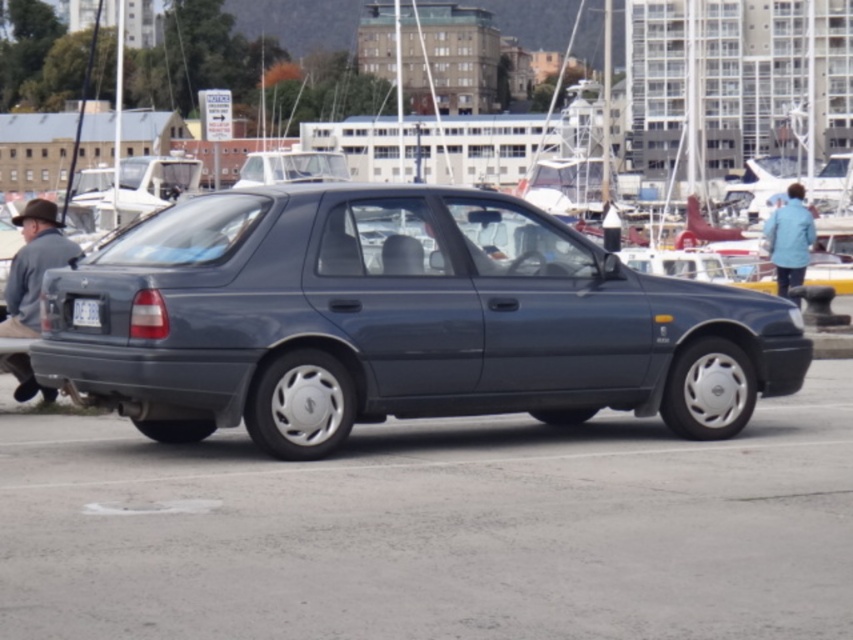
Does point (788, 228) lie in front of point (82, 321)?

No, (788, 228) is behind (82, 321).

Is point (788, 275) positioned in front of point (79, 316)?

No, (788, 275) is behind (79, 316).

You are a GUI agent. You are given a task and a screenshot of the screen. Output one action in this format:
    pyautogui.click(x=<x>, y=<y>)
    Task: Click on the light blue fabric jacket at upper right
    The height and width of the screenshot is (640, 853).
    Given the screenshot: What is the action you would take?
    pyautogui.click(x=788, y=240)

In order to click on brown fabric hat at left in this screenshot , I will do `click(33, 266)`.

Does brown fabric hat at left appear over white plastic license plate at center?

Indeed, brown fabric hat at left is positioned over white plastic license plate at center.

The image size is (853, 640). Identify the location of brown fabric hat at left. (33, 266).

Which is in front, point (33, 232) or point (808, 259)?

Point (33, 232) is more forward.

Describe the element at coordinates (33, 266) in the screenshot. I see `brown fabric hat at left` at that location.

The height and width of the screenshot is (640, 853). Identify the location of brown fabric hat at left. (33, 266).